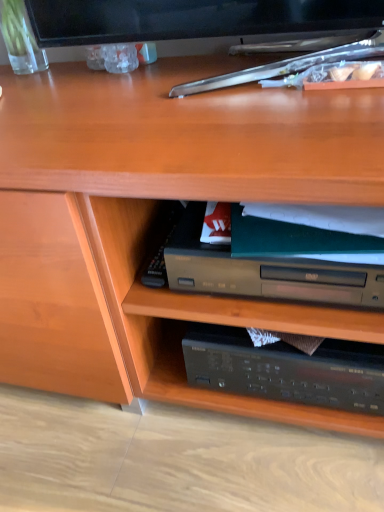
This screenshot has height=512, width=384. I want to click on free space above green matte paperback book at center (from a real-world perspective), so click(276, 223).